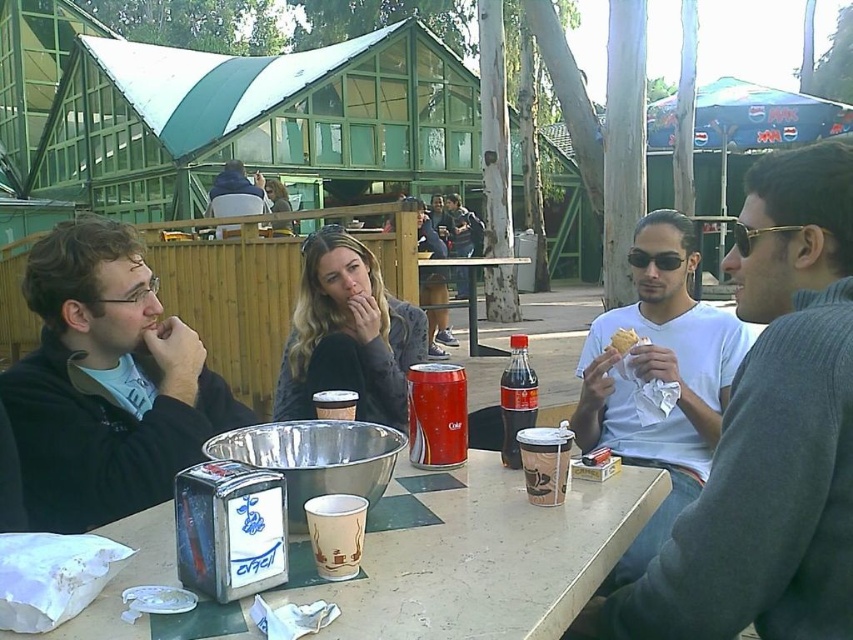
You are standing at the center of the table in the outdoor dining scene. You need to locate the gray sweater at right. Which direction should you look to find it?

The gray sweater at right is located at the right side of the table, so you should look to your right to find it.

You are standing at the table in the outdoor dining scene. There are two points marked on the table surface. Which point is closer to you, point [554,442] or point [264,193]?

Point [554,442] is closer to you than point [264,193].